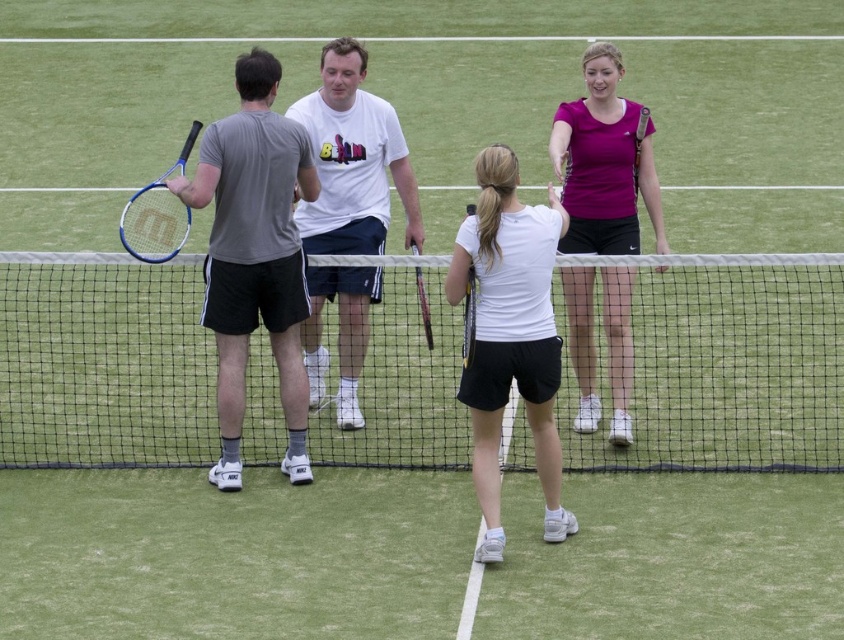
Question: Which object is farther from the camera taking this photo?

Choices:
 (A) wooden tennis racket at center
 (B) white mesh net at center
 (C) white matte tennis racket at center
 (D) purple matte tennis racket at upper right

Answer: (B)

Question: Considering the relative positions of white matte tennis racket at center and purple matte tennis racket at upper right in the image provided, where is white matte tennis racket at center located with respect to purple matte tennis racket at upper right?

Choices:
 (A) above
 (B) below

Answer: (B)

Question: Is purple matte tennis racket at upper right above wooden tennis racket at center?

Choices:
 (A) no
 (B) yes

Answer: (B)

Question: Which point is farther from the camera taking this photo?

Choices:
 (A) click(x=567, y=337)
 (B) click(x=430, y=333)
 (C) click(x=312, y=429)

Answer: (A)

Question: Based on their relative distances, which object is nearer to the black matte tennis racket at center?

Choices:
 (A) white matte t-shirt at center
 (B) white mesh net at center

Answer: (A)

Question: Is white matte tennis racket at center wider than white matte t-shirt at center?

Choices:
 (A) no
 (B) yes

Answer: (A)